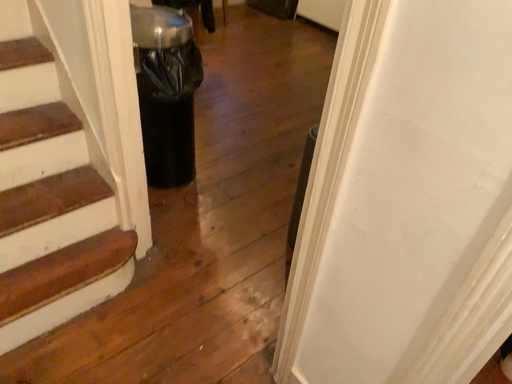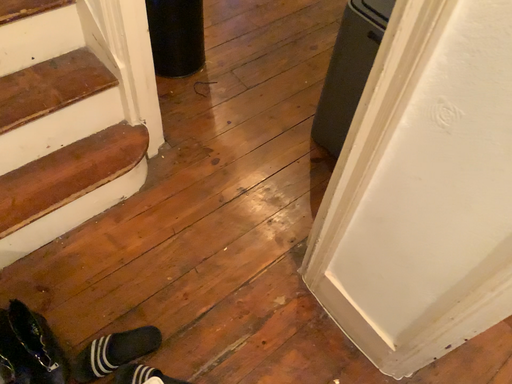
Question: How did the camera likely rotate when shooting the video?

Choices:
 (A) rotated downward
 (B) rotated upward

Answer: (A)